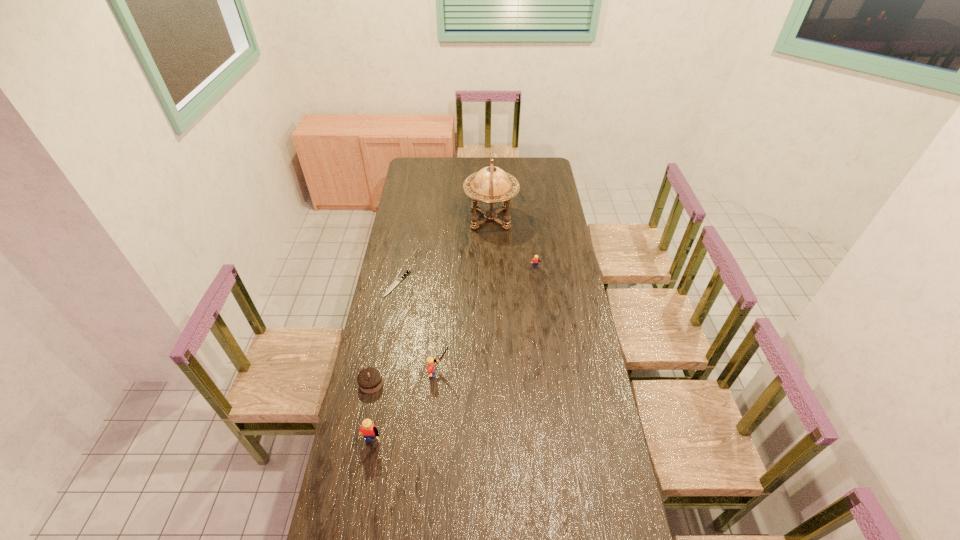
Find the location of a particular element. This screenshot has height=540, width=960. free region that satisfies the following two spatial constraints: 1. on the front-facing side of the rightmost Lego; 2. on the front-facing side of the second nearest Lego is located at coordinates (549, 374).